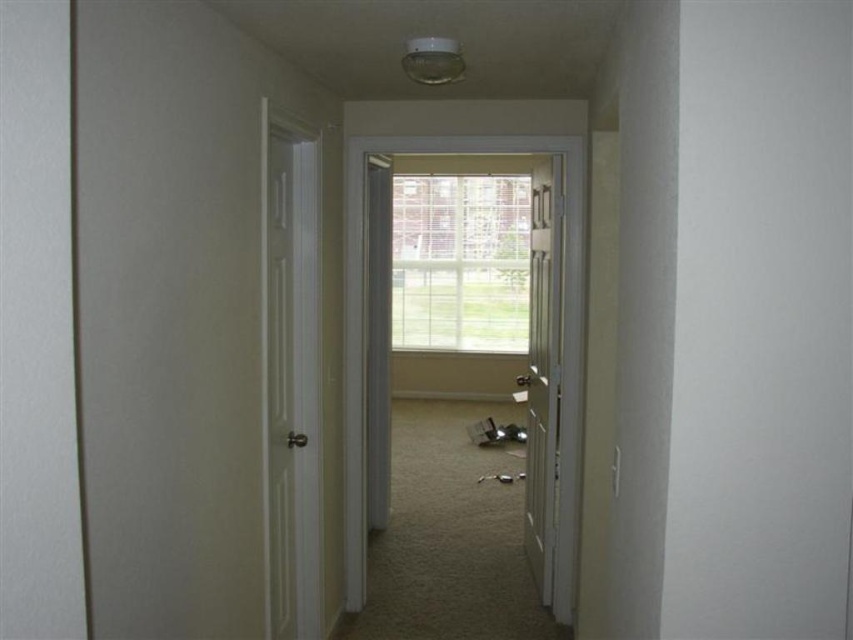
You are standing at the entrance of the hallway and want to reach the point at coordinates point (527, 188). The hallway is 25 feet long. Is the point within the hallway?

The point (527, 188) is 24.50 feet from the camera, which is within the 25 feet length of the hallway. Therefore, the point is inside the hallway.

You are moving a large painting that is 1.5 meters wide. You need to pass through the hallway and want to ensure it can fit through either the white smooth door at left or the clear glass window at center. Which one can the painting fit through based on their sizes?

The clear glass window at center is larger than the white smooth door at left. Since the painting is 1.5 meters wide, it can only fit through the clear glass window at center if its width is equal to or larger than 1.5 meters. However, since the window is larger than the door, the window is the better option for passing the painting through.

You are moving a large painting that is 1.5 meters wide. You need to pass through the hallway and go through one of the doors. Which door between the white smooth door at left and the white wood door at center can you use to carry the painting through?

The white wood door at center is larger in size than the white smooth door at left, so the white wood door at center can accommodate the 1.5 meters wide painting.